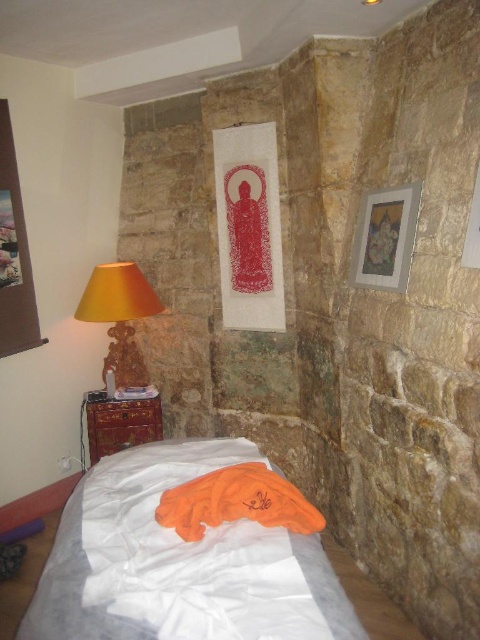
Question: Is white fabric bed at lower left above orange fabric at lower center?

Choices:
 (A) yes
 (B) no

Answer: (B)

Question: In this image, where is orange fabric at lower center located relative to wooden glossy dresser at lower left?

Choices:
 (A) left
 (B) right

Answer: (B)

Question: Among these points, which one is farthest from the camera?

Choices:
 (A) (141, 416)
 (B) (352, 280)
 (C) (148, 545)
 (D) (90, 298)

Answer: (A)

Question: Does matte wooden picture frame at upper right have a greater width compared to wooden glossy dresser at lower left?

Choices:
 (A) no
 (B) yes

Answer: (A)

Question: Among these objects, which one is farthest from the camera?

Choices:
 (A) orange fabric at lower center
 (B) white fabric bed at lower left

Answer: (A)

Question: Which object is positioned closest to the orange fabric lampshade at left?

Choices:
 (A) matte wooden picture frame at upper right
 (B) orange fabric at lower center

Answer: (A)